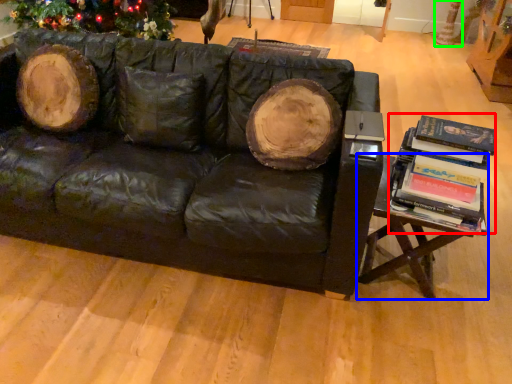
Question: Which is farther away from book (highlighted by a red box)? table (highlighted by a blue box) or tree trunk (highlighted by a green box)?

Choices:
 (A) table
 (B) tree trunk

Answer: (B)